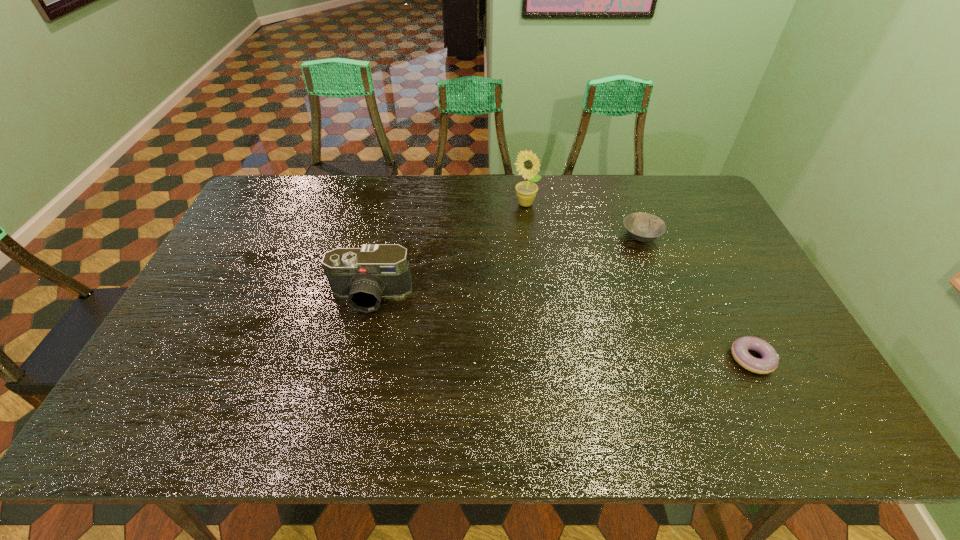
Locate an element on the screen. Image resolution: width=960 pixels, height=540 pixels. the tallest object is located at coordinates (527, 164).

You are a GUI agent. You are given a task and a screenshot of the screen. Output one action in this format:
    pyautogui.click(x=<x>, y=<y>)
    Task: Click on the farthest object
    
    Given the screenshot: What is the action you would take?
    pyautogui.click(x=527, y=164)

Locate an element on the screen. The image size is (960, 540). camera is located at coordinates (364, 275).

Image resolution: width=960 pixels, height=540 pixels. I want to click on the leftmost object, so click(364, 275).

At what (x,y) coordinates should I click in order to perform the action: click on the second farthest object. Please return your answer as a coordinate pair (x, y). The width and height of the screenshot is (960, 540). Looking at the image, I should click on (644, 227).

Identify the location of the third object from left to right. The width and height of the screenshot is (960, 540). (644, 227).

Where is `the rightmost object`? the rightmost object is located at coordinates (769, 362).

At what (x,y) coordinates should I click in order to perform the action: click on the nearest object. Please return your answer as a coordinate pair (x, y). This screenshot has width=960, height=540. Looking at the image, I should click on (769, 362).

Where is `vacant area situated 0.400m on the face of the sunflower`? This screenshot has width=960, height=540. vacant area situated 0.400m on the face of the sunflower is located at coordinates (537, 300).

Locate an element on the screen. This screenshot has height=540, width=960. vacant space positioned 0.250m on the front-facing side of the second nearest object is located at coordinates (347, 400).